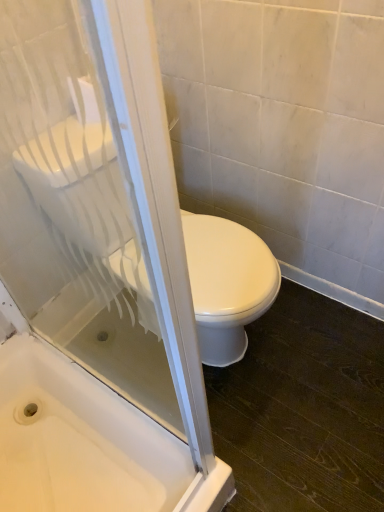
Question: From the image's perspective, would you say white glossy bathtub at lower left is positioned over white glossy toilet at center?

Choices:
 (A) yes
 (B) no

Answer: (B)

Question: Is white glossy bathtub at lower left further to camera compared to white glossy toilet at center?

Choices:
 (A) no
 (B) yes

Answer: (B)

Question: Considering the relative sizes of white glossy bathtub at lower left and white glossy toilet at center in the image provided, is white glossy bathtub at lower left bigger than white glossy toilet at center?

Choices:
 (A) no
 (B) yes

Answer: (A)

Question: Can you confirm if white glossy bathtub at lower left is positioned to the right of white glossy toilet at center?

Choices:
 (A) no
 (B) yes

Answer: (A)

Question: Is white glossy bathtub at lower left smaller than white glossy toilet at center?

Choices:
 (A) no
 (B) yes

Answer: (B)

Question: Would you say white glossy bathtub at lower left is a long distance from white glossy toilet at center?

Choices:
 (A) yes
 (B) no

Answer: (B)

Question: Is transparent glass screen door at upper left to the left of white glossy bathtub at lower left from the viewer's perspective?

Choices:
 (A) yes
 (B) no

Answer: (B)

Question: Considering the relative sizes of transparent glass screen door at upper left and white glossy bathtub at lower left in the image provided, is transparent glass screen door at upper left smaller than white glossy bathtub at lower left?

Choices:
 (A) yes
 (B) no

Answer: (A)

Question: Is the position of transparent glass screen door at upper left less distant than that of white glossy bathtub at lower left?

Choices:
 (A) yes
 (B) no

Answer: (A)

Question: Does transparent glass screen door at upper left have a greater height compared to white glossy bathtub at lower left?

Choices:
 (A) no
 (B) yes

Answer: (B)

Question: Is transparent glass screen door at upper left beside white glossy bathtub at lower left?

Choices:
 (A) yes
 (B) no

Answer: (B)

Question: From a real-world perspective, does transparent glass screen door at upper left stand above white glossy bathtub at lower left?

Choices:
 (A) yes
 (B) no

Answer: (A)

Question: Considering the relative sizes of white glossy bathtub at lower left and transparent glass screen door at upper left in the image provided, is white glossy bathtub at lower left thinner than transparent glass screen door at upper left?

Choices:
 (A) yes
 (B) no

Answer: (B)